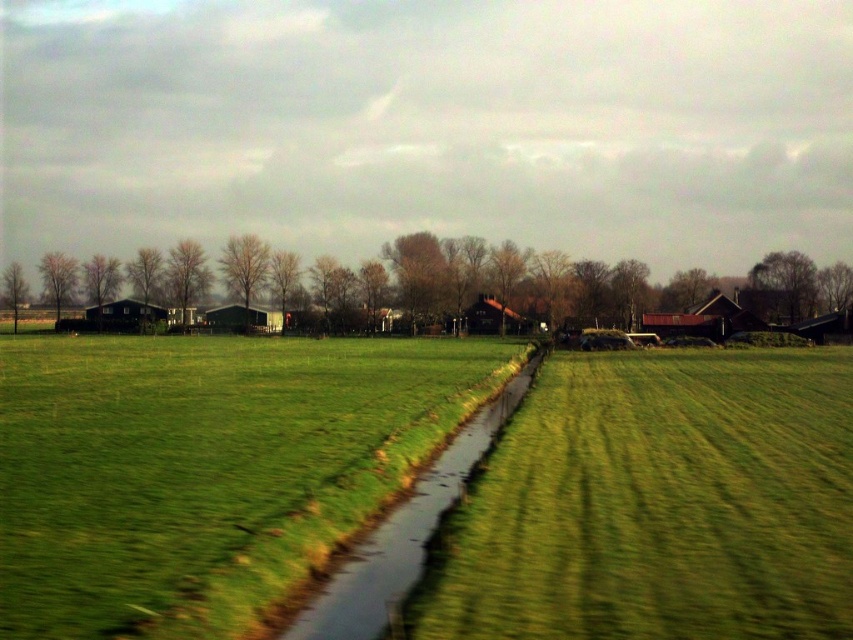
Question: Which point is farther from the camera taking this photo?

Choices:
 (A) (451, 440)
 (B) (76, 518)

Answer: (A)

Question: Does green grassy field at center have a greater width compared to green grassy stream at center?

Choices:
 (A) yes
 (B) no

Answer: (A)

Question: Which object appears farthest from the camera in this image?

Choices:
 (A) green grassy field at center
 (B) green grassy stream at center

Answer: (B)

Question: Which of the following is the closest to the observer?

Choices:
 (A) green grassy stream at center
 (B) green grassy field at center

Answer: (B)

Question: Is green grassy field at center further to camera compared to green grassy stream at center?

Choices:
 (A) no
 (B) yes

Answer: (A)

Question: Considering the relative positions of green grassy field at center and green grassy stream at center in the image provided, where is green grassy field at center located with respect to green grassy stream at center?

Choices:
 (A) above
 (B) below

Answer: (A)